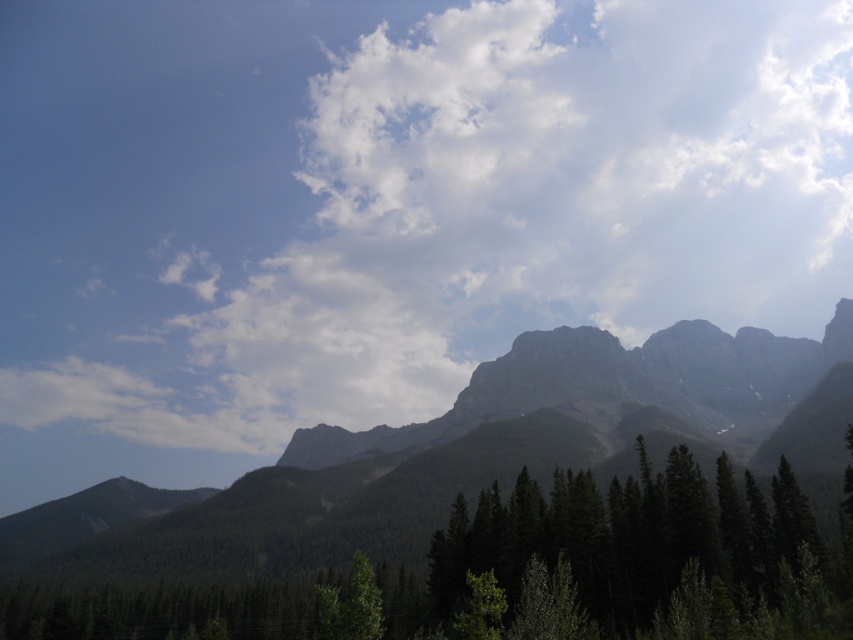
You are a drone operator who needs to fly a drone from the drone launch area at the base of the mountains to a specific point in the sky. The target point is at coordinates 0.311 on the x axis and 0.464 on the y axis. Is there a white fluffy cloud at upper center in the way of the drone path?

The white fluffy cloud at upper center is located at the exact coordinates of the target point, so the drone path will be obstructed by the white fluffy cloud at upper center.